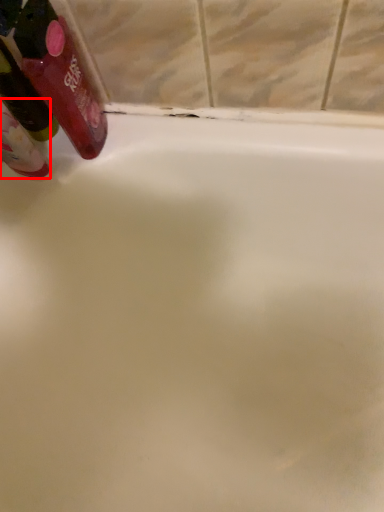
Question: Observing the image, what is the correct spatial positioning of mouthwash (annotated by the red box) in reference to mouthwash?

Choices:
 (A) right
 (B) left

Answer: (B)